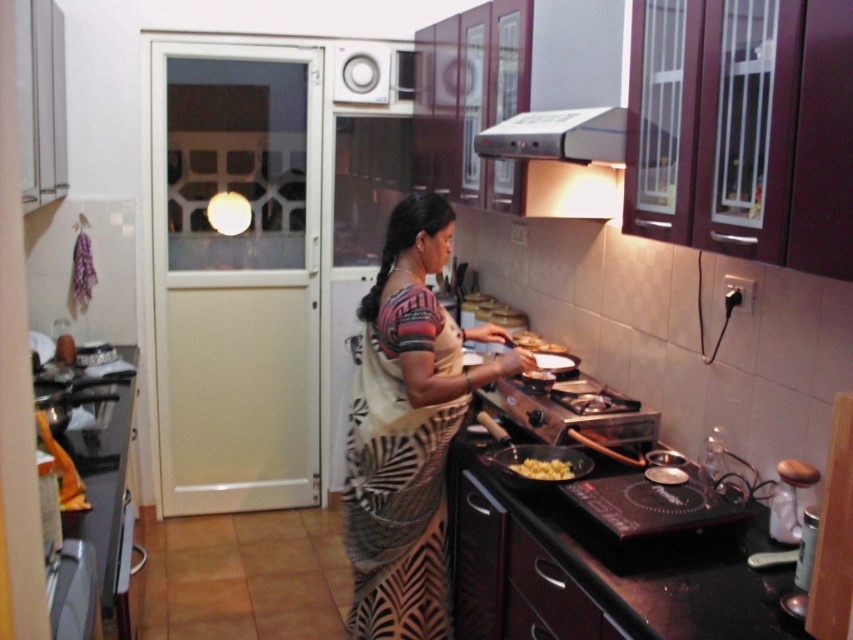
Looking at this image, is silver metallic exhaust hood at upper center positioned before yellow matte food at lower center?

Yes, it is.

Who is taller, silver metallic exhaust hood at upper center or yellow matte food at lower center?

silver metallic exhaust hood at upper center is taller.

Is point (590, 141) behind point (549, 477)?

No, (590, 141) is closer to viewer.

This screenshot has height=640, width=853. What are the coordinates of `silver metallic exhaust hood at upper center` in the screenshot? It's located at (560, 136).

Does printed cotton saree at center have a greater width compared to silver metallic exhaust hood at upper center?

Indeed, printed cotton saree at center has a greater width compared to silver metallic exhaust hood at upper center.

Is point (424, 371) closer to camera compared to point (608, 132)?

No, it is behind (608, 132).

Does point (426, 440) lie behind point (550, 156)?

Yes, point (426, 440) is behind point (550, 156).

Locate an element on the screen. The image size is (853, 640). printed cotton saree at center is located at coordinates (408, 429).

Between point (368, 349) and point (547, 458), which one is positioned in front?

Point (547, 458) is more forward.

Find the location of `printed cotton saree at center`. printed cotton saree at center is located at coordinates (408, 429).